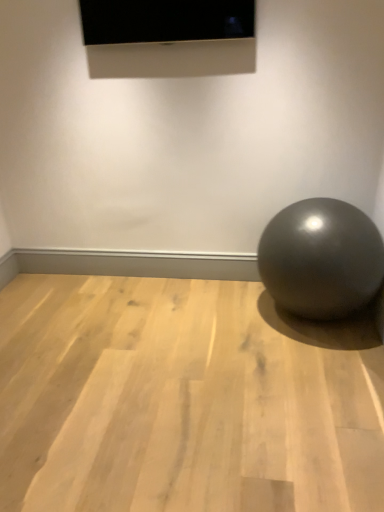
Question: Can you confirm if matte black screen at upper center is thinner than light wood floor at center?

Choices:
 (A) no
 (B) yes

Answer: (B)

Question: Would you say matte black screen at upper center is a long distance from light wood floor at center?

Choices:
 (A) yes
 (B) no

Answer: (A)

Question: Does matte black screen at upper center appear on the left side of light wood floor at center?

Choices:
 (A) yes
 (B) no

Answer: (B)

Question: Is matte black screen at upper center at the right side of light wood floor at center?

Choices:
 (A) yes
 (B) no

Answer: (A)

Question: Is matte black screen at upper center bigger than light wood floor at center?

Choices:
 (A) no
 (B) yes

Answer: (A)

Question: From a real-world perspective, is matte black screen at upper center above or below glossy metallic ball at lower right?

Choices:
 (A) below
 (B) above

Answer: (B)

Question: Relative to glossy metallic ball at lower right, is matte black screen at upper center in front or behind?

Choices:
 (A) front
 (B) behind

Answer: (B)

Question: Is matte black screen at upper center bigger or smaller than glossy metallic ball at lower right?

Choices:
 (A) small
 (B) big

Answer: (A)

Question: Is point (110, 22) positioned closer to the camera than point (367, 275)?

Choices:
 (A) closer
 (B) farther

Answer: (B)

Question: From their relative heights in the image, would you say glossy metallic ball at lower right is taller or shorter than matte black screen at upper center?

Choices:
 (A) short
 (B) tall

Answer: (B)

Question: Choose the correct answer: Is glossy metallic ball at lower right inside matte black screen at upper center or outside it?

Choices:
 (A) inside
 (B) outside

Answer: (B)

Question: Is glossy metallic ball at lower right in front of or behind matte black screen at upper center in the image?

Choices:
 (A) front
 (B) behind

Answer: (A)

Question: Is glossy metallic ball at lower right wider or thinner than matte black screen at upper center?

Choices:
 (A) thin
 (B) wide

Answer: (B)

Question: Choose the correct answer: Is light wood floor at center inside glossy metallic ball at lower right or outside it?

Choices:
 (A) inside
 (B) outside

Answer: (B)

Question: Does point (51, 458) appear closer or farther from the camera than point (274, 280)?

Choices:
 (A) farther
 (B) closer

Answer: (B)